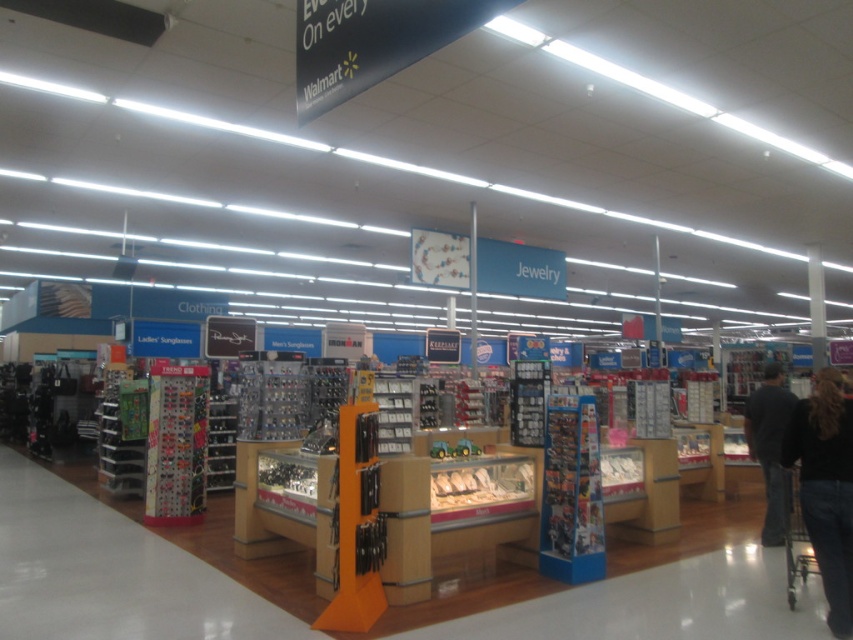
You are a customer in the Walmart jewelry section and see two items at the lower right of your view. Which one is positioned to the left between the black denim jeans at lower right and the black fabric pants at lower right?

Answer: The black denim jeans at lower right is positioned to the left of the black fabric pants at lower right.

You are standing in the Walmart jewelry section and need to find the black denim jeans at lower right. According to the store layout, where should you look relative to the jewelry displays?

The black denim jeans at lower right are located at point (827,486), which is to the lower right side of the jewelry displays.